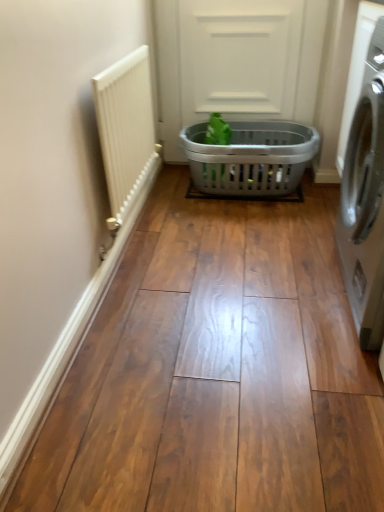
Find the location of a particular element. The height and width of the screenshot is (512, 384). vacant space to the left of satin silver washing machine at right is located at coordinates (252, 298).